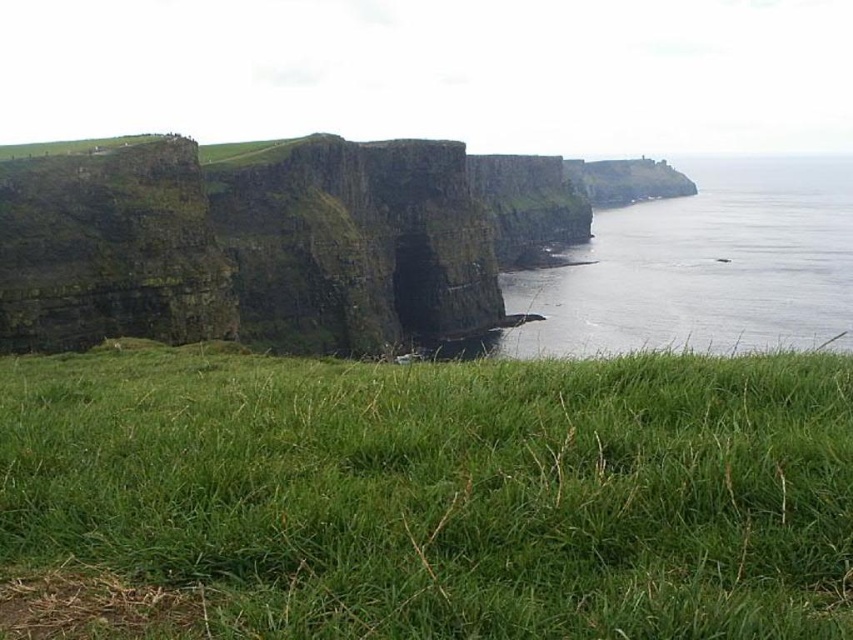
Does green grassy at lower center have a lesser height compared to transparent water at right?

Indeed, green grassy at lower center has a lesser height compared to transparent water at right.

The height and width of the screenshot is (640, 853). What do you see at coordinates (424, 497) in the screenshot?
I see `green grassy at lower center` at bounding box center [424, 497].

Who is more forward, (345,401) or (685,339)?

Point (345,401)

Locate an element on the screen. The height and width of the screenshot is (640, 853). green grassy at lower center is located at coordinates (424, 497).